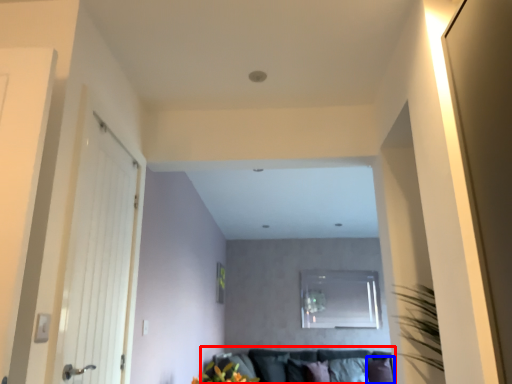
Question: Which of the following is the farthest to the observer, couch (highlighted by a red box) or pillow (highlighted by a blue box)?

Choices:
 (A) couch
 (B) pillow

Answer: (B)